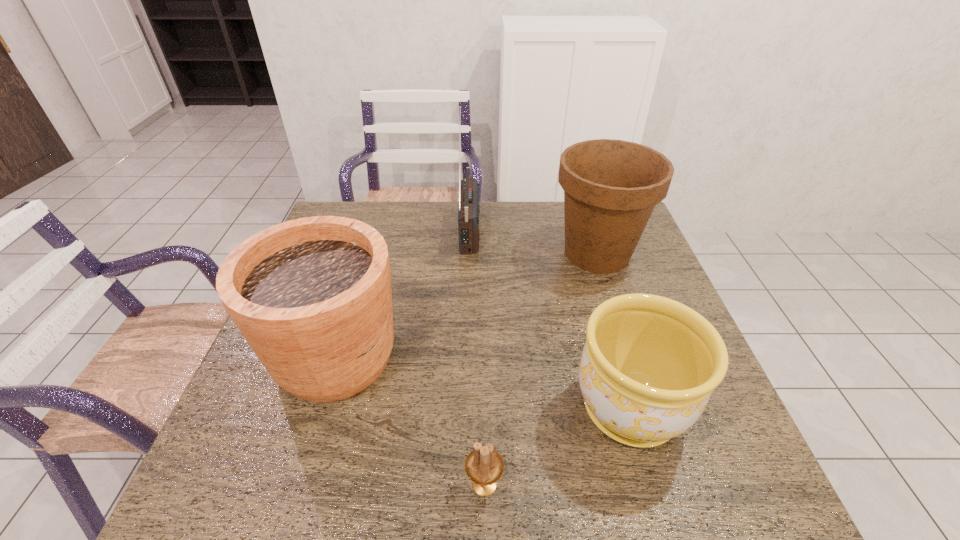
You are a GUI agent. You are given a task and a screenshot of the screen. Output one action in this format:
    pyautogui.click(x=<x>, y=<y>)
    Task: Click on the free space located on the back of the candle holder
    Image resolution: width=960 pixels, height=540 pixels.
    Given the screenshot: What is the action you would take?
    pyautogui.click(x=484, y=419)

The image size is (960, 540). I want to click on radio receiver that is at the far edge, so click(x=469, y=208).

In order to click on flowerpot at the far edge in this screenshot , I will do point(611,187).

At what (x,y) coordinates should I click in order to perform the action: click on flowerpot that is at the near edge. Please return your answer as a coordinate pair (x, y). The image size is (960, 540). Looking at the image, I should click on (649, 365).

Where is `candle holder located in the near edge section of the desktop`? candle holder located in the near edge section of the desktop is located at coordinates (484, 466).

This screenshot has height=540, width=960. Identify the location of object that is at the left edge. (312, 296).

Find the location of a particular element. The height and width of the screenshot is (540, 960). object that is at the far right corner is located at coordinates (611, 187).

The width and height of the screenshot is (960, 540). I want to click on object that is at the near right corner, so click(x=649, y=365).

The width and height of the screenshot is (960, 540). What are the coordinates of `free point at the far edge` in the screenshot? It's located at (432, 213).

What are the coordinates of `vacant space at the near edge of the desktop` in the screenshot? It's located at (331, 465).